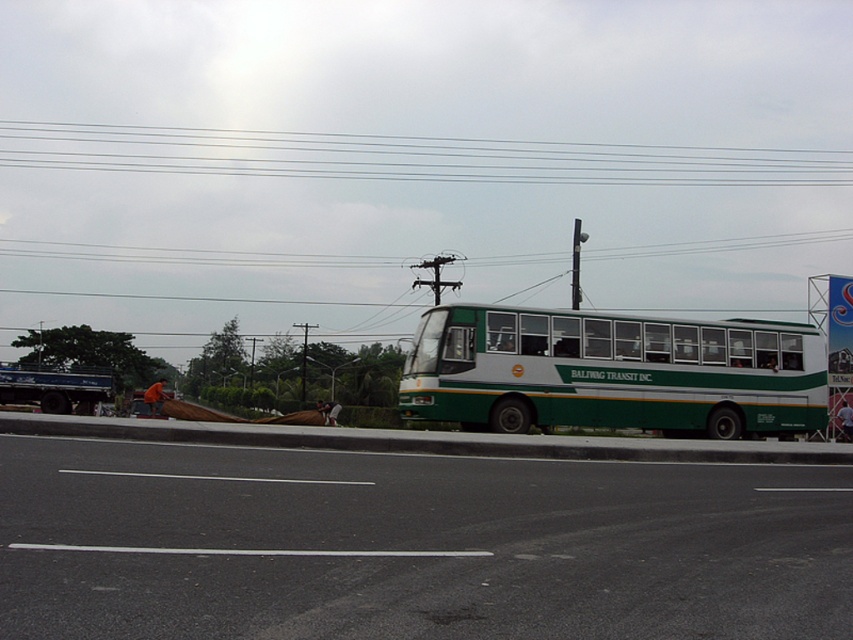
Is point (451, 355) positioned after point (825, 180)?

No.

Looking at this image, does green matte bus at center have a larger size compared to clear plastic power lines at upper center?

Incorrect, green matte bus at center is not larger than clear plastic power lines at upper center.

At what (x,y) coordinates should I click in order to perform the action: click on green matte bus at center. Please return your answer as a coordinate pair (x, y). Image resolution: width=853 pixels, height=640 pixels. Looking at the image, I should click on (613, 372).

Who is more distant from viewer, (581, 403) or (833, 344)?

The point (833, 344) is more distant.

Which is in front, point (822, 371) or point (827, 305)?

Positioned in front is point (822, 371).

Find the location of a particular element. The height and width of the screenshot is (640, 853). green matte bus at center is located at coordinates (613, 372).

Is clear plastic power lines at upper center taller than green painted metal bus stop at center right?

In fact, clear plastic power lines at upper center may be shorter than green painted metal bus stop at center right.

In order to click on clear plastic power lines at upper center in this screenshot , I will do `click(408, 157)`.

What are the coordinates of `clear plastic power lines at upper center` in the screenshot? It's located at (408, 157).